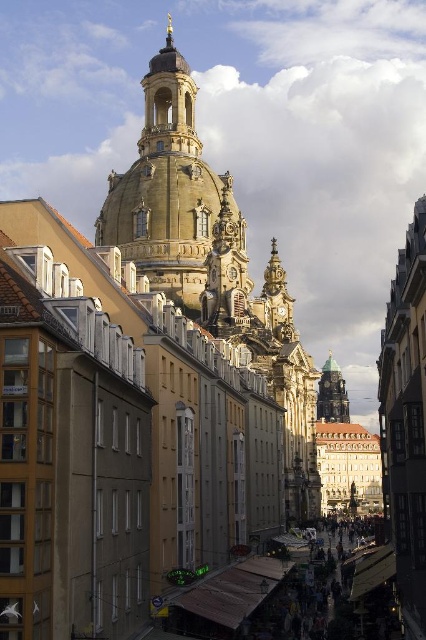
You are standing in the square in front of the church and want to take a photo of both the golden stone tower at upper center and the gold textured dome at center. Which object should you focus on first to ensure both are in the frame?

You should focus on the golden stone tower at upper center first because it is closer to the viewer than the gold textured dome at center, so adjusting the camera to include the closer tower will naturally include the dome in the background.

You are an urban planner evaluating the skyline of this area. Based on the image, which of the two structures, the golden stone tower at upper center or the gold textured dome at center, would cast a longer shadow during midday? Please explain your reasoning.

The golden stone tower at upper center has a larger size compared to the gold textured dome at center. Since the tower is taller and larger, it would cast a longer shadow during midday than the dome.